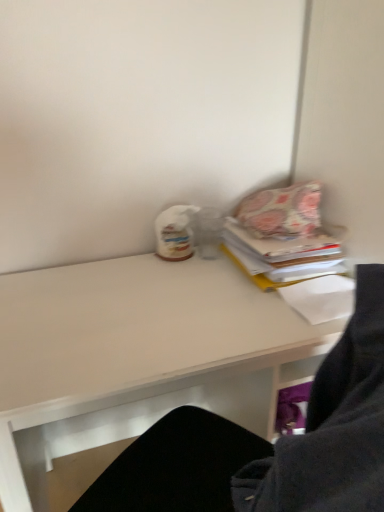
Question: Does white matte desk at center lie behind floral fabric pillow at upper right?

Choices:
 (A) yes
 (B) no

Answer: (B)

Question: Is white matte desk at center bigger than floral fabric pillow at upper right?

Choices:
 (A) no
 (B) yes

Answer: (B)

Question: From a real-world perspective, is white matte desk at center physically above floral fabric pillow at upper right?

Choices:
 (A) no
 (B) yes

Answer: (A)

Question: Is white matte desk at center to the right of floral fabric pillow at upper right from the viewer's perspective?

Choices:
 (A) no
 (B) yes

Answer: (A)

Question: Can you confirm if white matte desk at center is thinner than floral fabric pillow at upper right?

Choices:
 (A) yes
 (B) no

Answer: (B)

Question: Which is correct: white matte desk at center is inside floral fabric pillow at upper right, or outside of it?

Choices:
 (A) inside
 (B) outside

Answer: (B)

Question: Looking at their shapes, would you say white matte desk at center is wider or thinner than floral fabric pillow at upper right?

Choices:
 (A) wide
 (B) thin

Answer: (A)

Question: In the image, is white matte desk at center on the left side or the right side of floral fabric pillow at upper right?

Choices:
 (A) left
 (B) right

Answer: (A)

Question: Does point (192, 286) appear closer or farther from the camera than point (258, 209)?

Choices:
 (A) farther
 (B) closer

Answer: (B)

Question: From a real-world perspective, relative to floral fabric pillow at upper right, is patterned fabric book at upper right vertically above or below?

Choices:
 (A) below
 (B) above

Answer: (A)

Question: Considering the positions of patterned fabric book at upper right and floral fabric pillow at upper right in the image, is patterned fabric book at upper right wider or thinner than floral fabric pillow at upper right?

Choices:
 (A) thin
 (B) wide

Answer: (B)

Question: Is patterned fabric book at upper right bigger or smaller than floral fabric pillow at upper right?

Choices:
 (A) small
 (B) big

Answer: (B)

Question: From the image's perspective, relative to floral fabric pillow at upper right, is patterned fabric book at upper right above or below?

Choices:
 (A) below
 (B) above

Answer: (A)

Question: Looking at the image, does floral fabric pillow at upper right seem bigger or smaller compared to patterned fabric book at upper right?

Choices:
 (A) big
 (B) small

Answer: (B)

Question: Is floral fabric pillow at upper right taller or shorter than patterned fabric book at upper right?

Choices:
 (A) tall
 (B) short

Answer: (A)